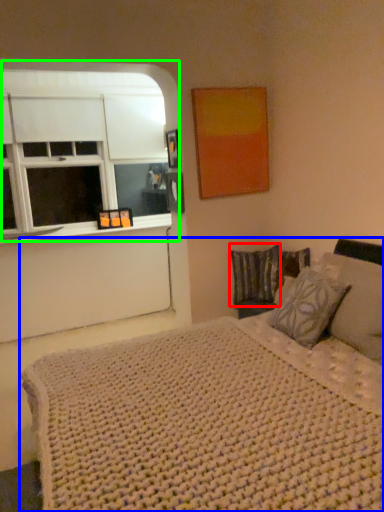
Question: Estimate the real-world distances between objects in this image. Which object is farther from pillow (highlighted by a red box), bed (highlighted by a blue box) or window (highlighted by a green box)?

Choices:
 (A) bed
 (B) window

Answer: (B)